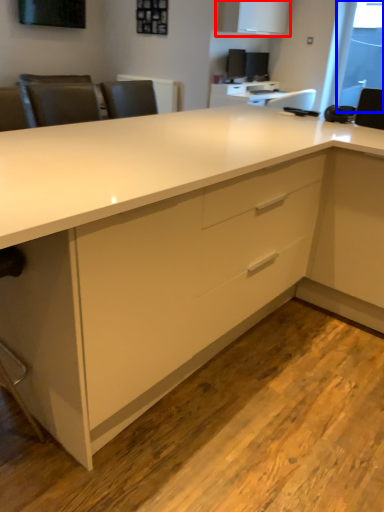
Question: Among these objects, which one is farthest to the camera, cabinetry (highlighted by a red box) or window screen (highlighted by a blue box)?

Choices:
 (A) cabinetry
 (B) window screen

Answer: (B)